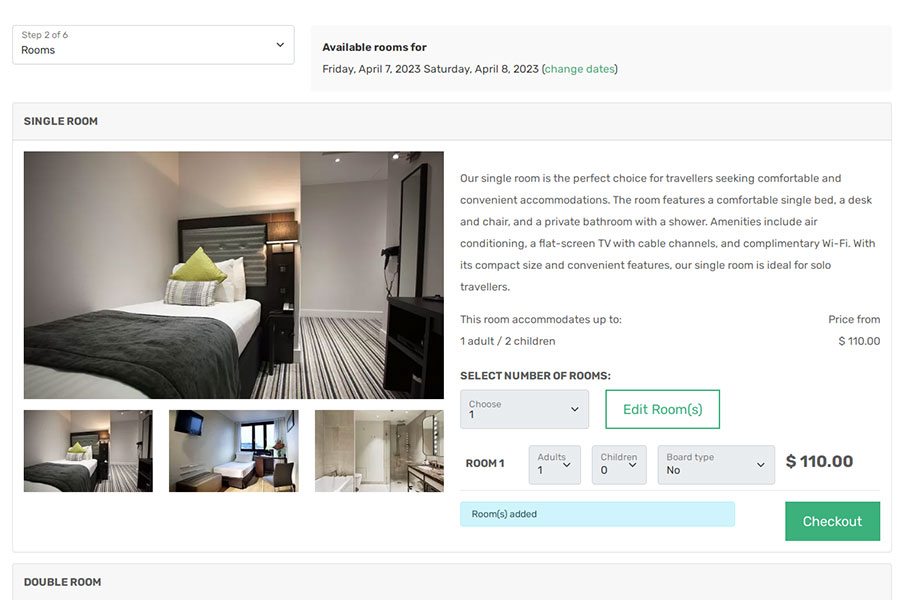
I want to click on single room options, so click(x=76, y=117).